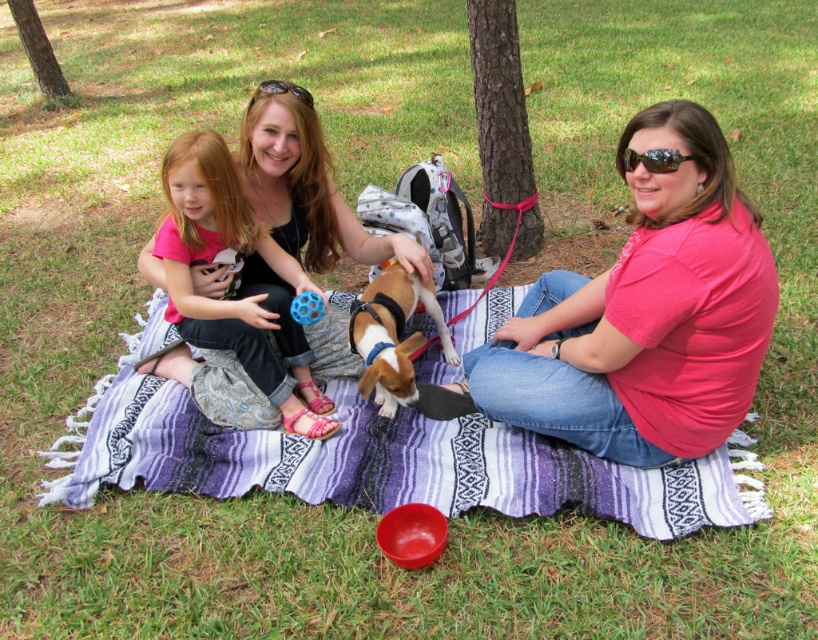
Does brown rough bark tree at center appear on the left side of brown rough tree trunk at upper left?

In fact, brown rough bark tree at center is to the right of brown rough tree trunk at upper left.

Consider the image. Between brown rough bark tree at center and brown rough tree trunk at upper left, which one is positioned higher?

brown rough tree trunk at upper left is higher up.

This screenshot has width=818, height=640. Describe the element at coordinates (499, 100) in the screenshot. I see `brown rough bark tree at center` at that location.

I want to click on brown rough bark tree at center, so click(499, 100).

Which is behind, point (223, 483) or point (311, 104)?

Positioned behind is point (311, 104).

The height and width of the screenshot is (640, 818). I want to click on purple woven blanket at center, so click(x=376, y=460).

Where is `purple woven blanket at center`? This screenshot has width=818, height=640. purple woven blanket at center is located at coordinates (x=376, y=460).

The width and height of the screenshot is (818, 640). Describe the element at coordinates (239, 288) in the screenshot. I see `pink fabric at center` at that location.

Does pink fabric at center appear under black rubber sunglasses at center?

Correct, pink fabric at center is located below black rubber sunglasses at center.

What do you see at coordinates (239, 288) in the screenshot? I see `pink fabric at center` at bounding box center [239, 288].

Find the location of a particular element. pink fabric at center is located at coordinates (239, 288).